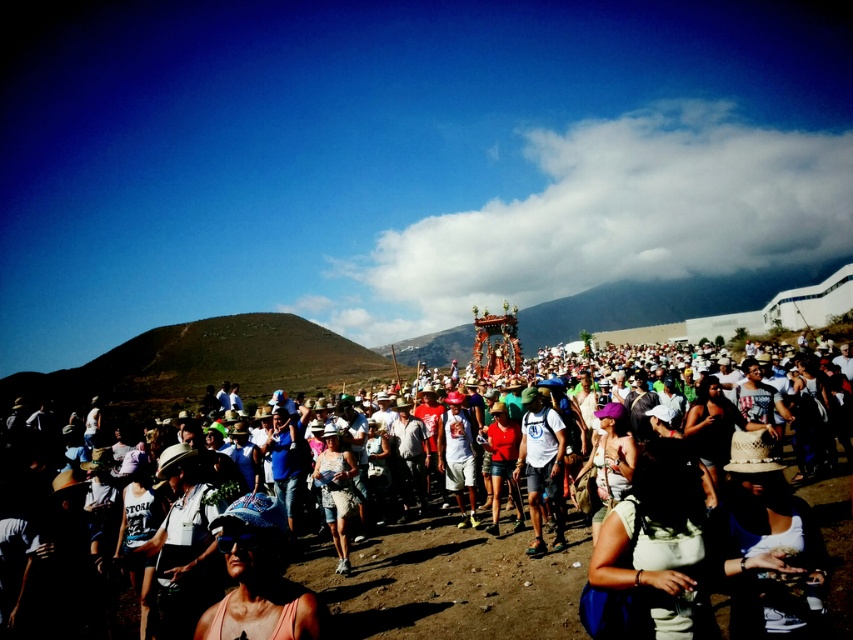
Question: Does white matte t-shirt at center appear over white cotton shorts at center?

Choices:
 (A) yes
 (B) no

Answer: (A)

Question: Can you confirm if white matte t-shirt at center is positioned above white cotton shorts at center?

Choices:
 (A) yes
 (B) no

Answer: (A)

Question: Which is nearer to the white cotton shorts at center?

Choices:
 (A) white matte t-shirt at center
 (B) matte white crowd at center

Answer: (B)

Question: Is matte white crowd at center closer to the viewer compared to white matte t-shirt at center?

Choices:
 (A) yes
 (B) no

Answer: (A)

Question: Which object is closer to the camera taking this photo?

Choices:
 (A) white cotton shorts at center
 (B) white matte t-shirt at center
 (C) matte white crowd at center

Answer: (C)

Question: Which object is closer to the camera taking this photo?

Choices:
 (A) matte white crowd at center
 (B) white matte t-shirt at center
 (C) white cotton shorts at center

Answer: (A)